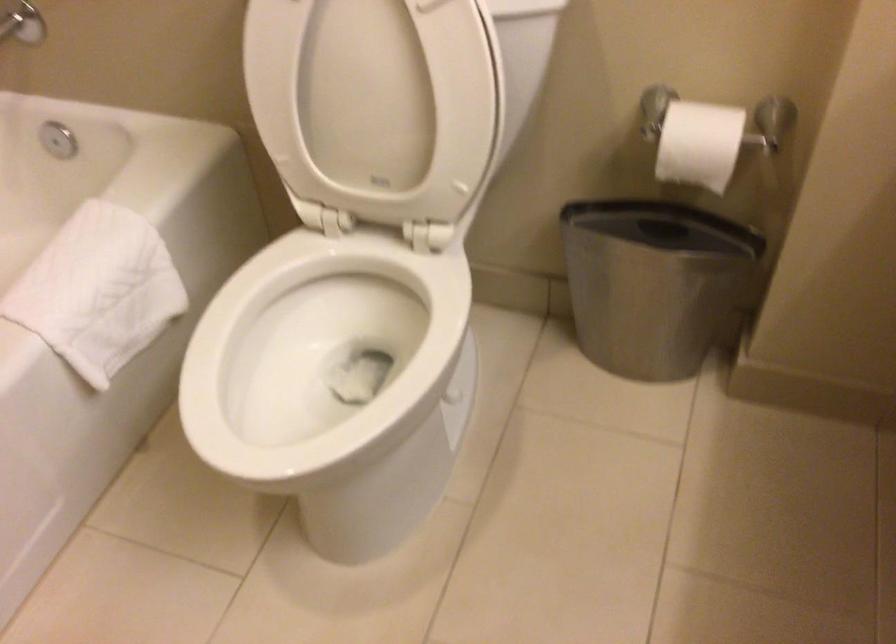
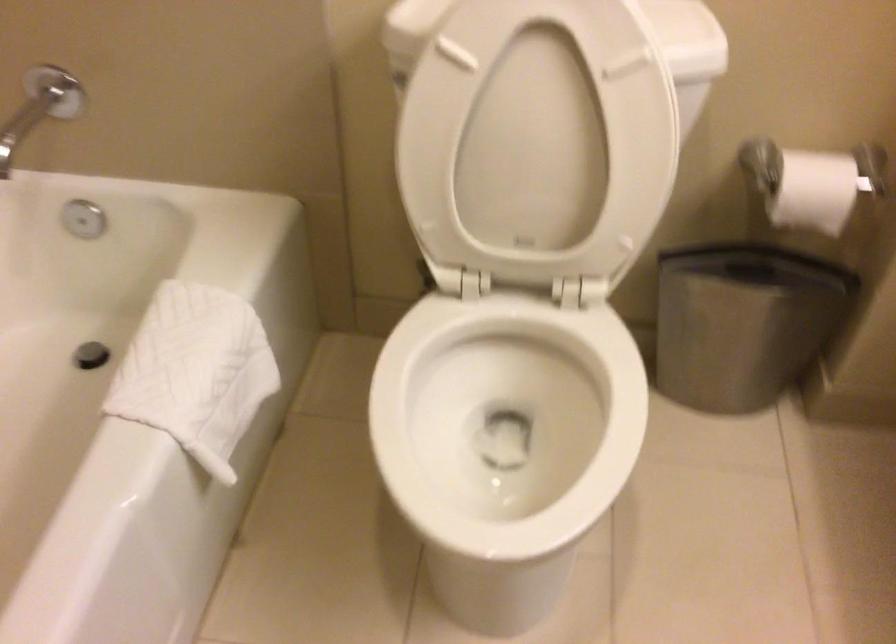
Locate, in the second image, the point that corresponds to the point at 82,285 in the first image.

(195, 372)